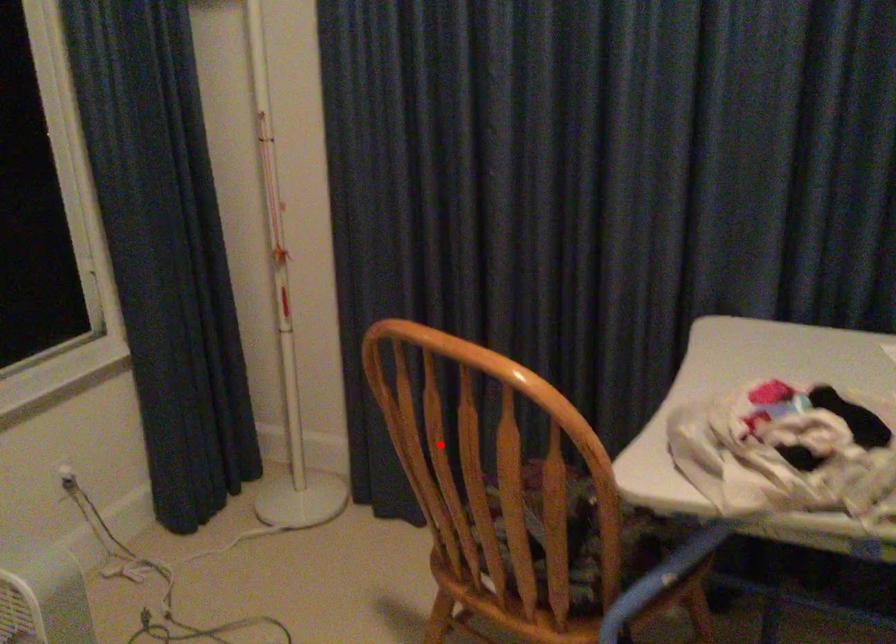
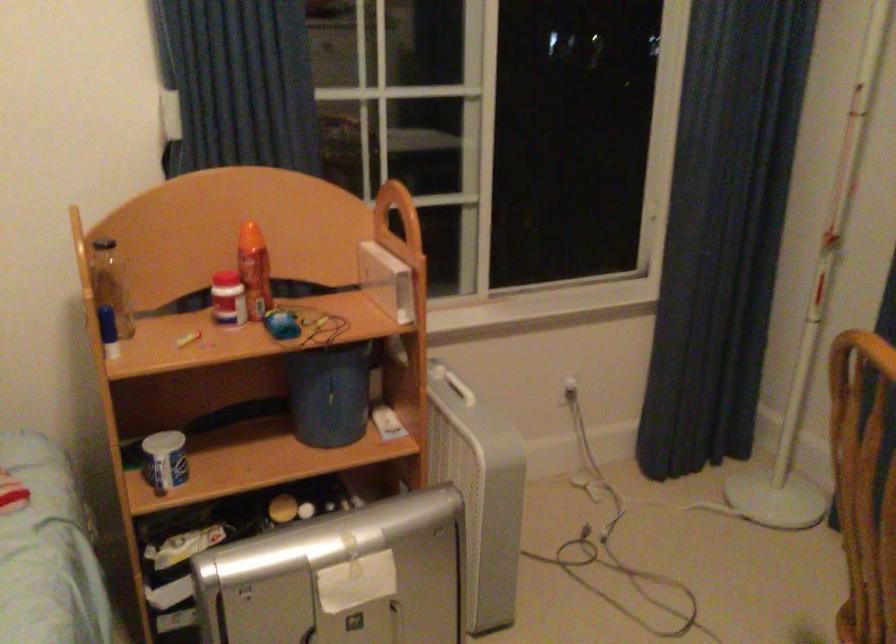
Question: I am providing you with two images of the same scene from different viewpoints. A red point is marked on the first image. At the location where the point appears in image 1, is it still visible in image 2?

Choices:
 (A) Yes
 (B) No

Answer: (A)